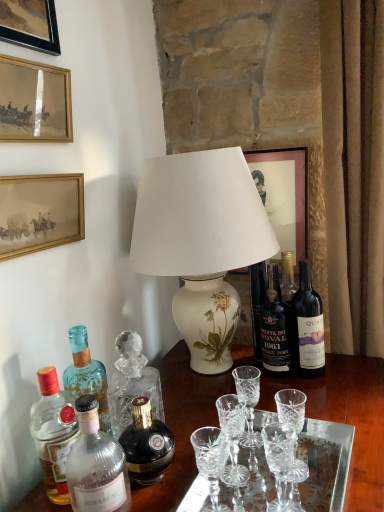
Question: Is gold-framed picture at upper left, which appears as the 2th picture frame when viewed from the right, oriented towards wooden picture frame at upper left, acting as the fourth picture frame starting from the right?

Choices:
 (A) yes
 (B) no

Answer: (B)

Question: Is gold-framed picture at upper left, which appears as the 2th picture frame when viewed from the right, shorter than wooden picture frame at upper left, acting as the fourth picture frame starting from the right?

Choices:
 (A) yes
 (B) no

Answer: (A)

Question: From the image's perspective, is gold-framed picture at upper left, which appears as the 2th picture frame when viewed from the right, on wooden picture frame at upper left, which is the first picture frame in left-to-right order?

Choices:
 (A) yes
 (B) no

Answer: (B)

Question: Is gold-framed picture at upper left, which is the third picture frame from left to right, further to the viewer compared to wooden picture frame at upper left, acting as the fourth picture frame starting from the right?

Choices:
 (A) no
 (B) yes

Answer: (B)

Question: From the image's perspective, is gold-framed picture at upper left, which appears as the 2th picture frame when viewed from the right, located beneath wooden picture frame at upper left, acting as the fourth picture frame starting from the right?

Choices:
 (A) no
 (B) yes

Answer: (B)

Question: Is dark blue glass bottle at center, acting as the second bottle starting from the right, taller or shorter than clear glass bottle at lower left, which is the fourth bottle from right to left?

Choices:
 (A) short
 (B) tall

Answer: (B)

Question: Considering the relative positions of dark blue glass bottle at center, acting as the second bottle starting from the right, and clear glass bottle at lower left, which is the fourth bottle from right to left, in the image provided, is dark blue glass bottle at center, acting as the second bottle starting from the right, to the left or to the right of clear glass bottle at lower left, which is the fourth bottle from right to left,?

Choices:
 (A) left
 (B) right

Answer: (B)

Question: Is point (281, 332) positioned closer to the camera than point (122, 503)?

Choices:
 (A) farther
 (B) closer

Answer: (A)

Question: From the image's perspective, is dark blue glass bottle at center, the 4th bottle positioned from the left, positioned above or below clear glass bottle at lower left, the 2th bottle in the left-to-right sequence?

Choices:
 (A) below
 (B) above

Answer: (B)

Question: Based on their positions, is dark glass bottle at right, acting as the first bottle starting from the right, located to the left or right of clear crystal wine glass at center?

Choices:
 (A) right
 (B) left

Answer: (A)

Question: From a real-world perspective, is dark glass bottle at right, acting as the first bottle starting from the right, above or below clear crystal wine glass at center?

Choices:
 (A) below
 (B) above

Answer: (B)

Question: In terms of size, does dark glass bottle at right, acting as the first bottle starting from the right, appear bigger or smaller than clear crystal wine glass at center?

Choices:
 (A) big
 (B) small

Answer: (A)

Question: Considering the positions of dark glass bottle at right, acting as the first bottle starting from the right, and clear crystal wine glass at center in the image, is dark glass bottle at right, acting as the first bottle starting from the right, taller or shorter than clear crystal wine glass at center?

Choices:
 (A) short
 (B) tall

Answer: (B)

Question: From the image's perspective, is wooden picture frame at upper left, acting as the fourth picture frame starting from the right, positioned above or below clear glass bottle at lower left, the 2th bottle in the left-to-right sequence?

Choices:
 (A) above
 (B) below

Answer: (A)

Question: Looking at the image, does wooden picture frame at upper left, acting as the fourth picture frame starting from the right, seem bigger or smaller compared to clear glass bottle at lower left, which is the fourth bottle from right to left?

Choices:
 (A) big
 (B) small

Answer: (A)